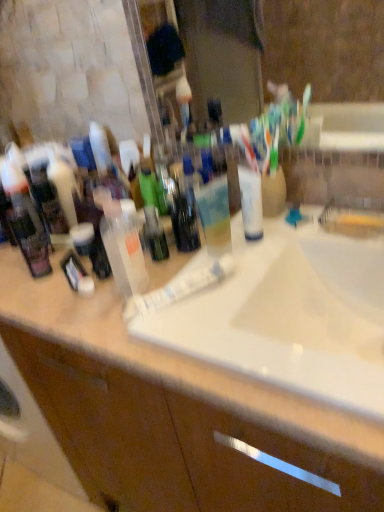
Question: Considering the positions of white matte jar at center-left, the second toiletry viewed from the right, and matte black lotion at center, arranged as the 1th toiletry when viewed from the left, in the image, is white matte jar at center-left, the second toiletry viewed from the right, bigger or smaller than matte black lotion at center, arranged as the 1th toiletry when viewed from the left,?

Choices:
 (A) small
 (B) big

Answer: (A)

Question: Does point (79, 233) appear closer or farther from the camera than point (56, 221)?

Choices:
 (A) farther
 (B) closer

Answer: (B)

Question: Based on their relative distances, which object is nearer to the translucent plastic bottle at center?

Choices:
 (A) white glossy tube at center
 (B) white glossy sink at center
 (C) brown wood bathroom cabinet at center
 (D) white plastic tube at center
 (E) white matte jar at center-left, positioned as the fourth toiletry in left-to-right order

Answer: (D)

Question: Which object is the closest to the translucent plastic bottle at center, the 5th toiletry from the left?

Choices:
 (A) white glossy tube at center
 (B) white matte jar at center-left, positioned as the fourth toiletry in left-to-right order
 (C) translucent plastic spray bottle at center
 (D) brown wood bathroom cabinet at center
 (E) white plastic tube at center

Answer: (C)